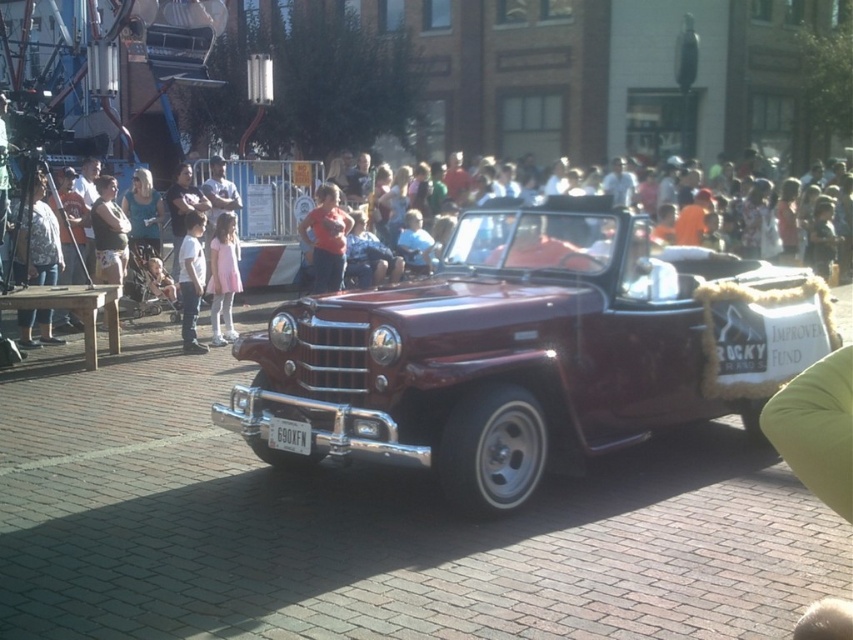
Does matte red shirt at center come behind white cotton shirt at left?

Yes, it is.

Is matte red shirt at center thinner than white cotton shirt at left?

In fact, matte red shirt at center might be wider than white cotton shirt at left.

Does point (332, 234) come farther from viewer compared to point (200, 292)?

That is True.

Identify the location of matte red shirt at center. The image size is (853, 640). (326, 237).

Which is more to the left, shiny maroon convertible at center or pink satin dress at center?

From the viewer's perspective, pink satin dress at center appears more on the left side.

Image resolution: width=853 pixels, height=640 pixels. What do you see at coordinates (526, 353) in the screenshot? I see `shiny maroon convertible at center` at bounding box center [526, 353].

Where is `shiny maroon convertible at center`? This screenshot has height=640, width=853. shiny maroon convertible at center is located at coordinates (526, 353).

Which is behind, point (654, 291) or point (273, 163)?

Point (273, 163)

Where is `shiny maroon convertible at center`? This screenshot has width=853, height=640. shiny maroon convertible at center is located at coordinates (526, 353).

At what (x,y) coordinates should I click in order to perform the action: click on shiny maroon convertible at center. Please return your answer as a coordinate pair (x, y). The height and width of the screenshot is (640, 853). Looking at the image, I should click on (526, 353).